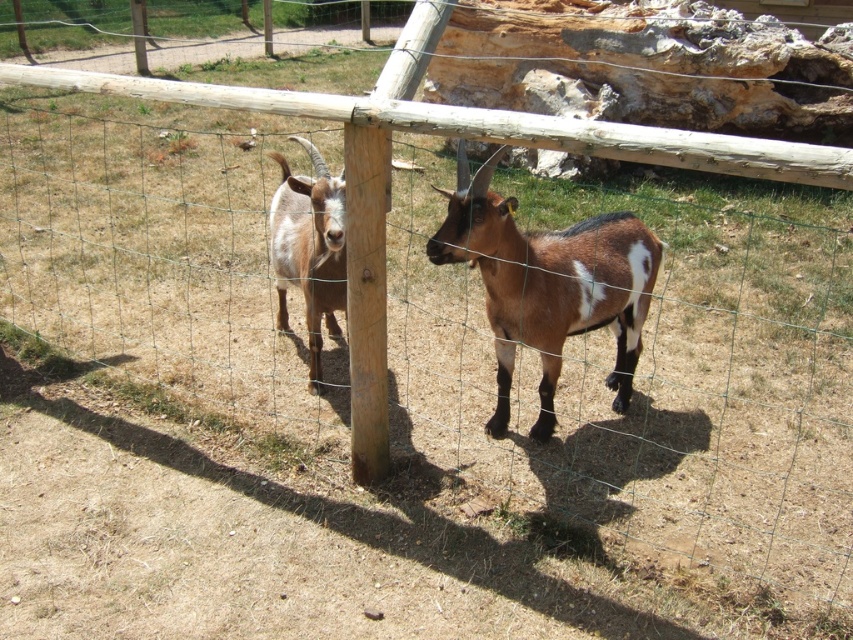
You are a zookeeper trying to separate the brown fuzzy goat at center and the white fur goat at center using a divider. Which goat should you place the divider to the left of to separate them?

The divider should be placed to the left of the white fur goat at center because the brown fuzzy goat at center is positioned on the right side of the white fur goat at center, so placing the divider to the left of the white fur goat would separate them.

Looking at this image, you are a zookeeper trying to locate two specific points in the enclosure. The first point is labeled as point [602,292] and the second is point [328,260]. Which point is nearer to your current position?

Point [602,292] is closer to the camera than point [328,260], so the first point is nearer to your current position.